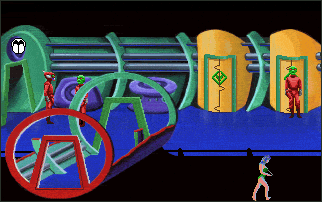
The image size is (322, 202). Find the location of `light`. light is located at coordinates (20, 51).